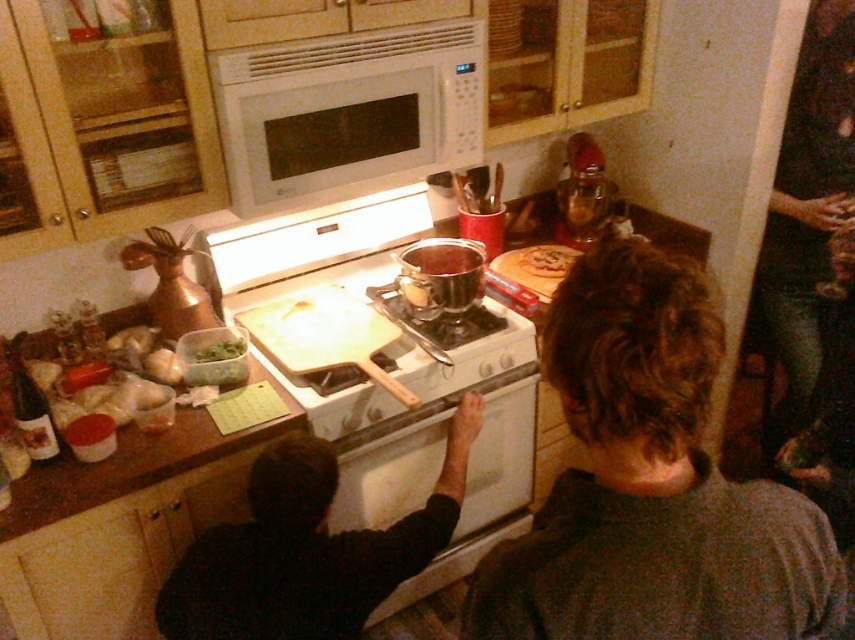
Between dark brown hair at center and white glossy stove at center, which one appears on the right side from the viewer's perspective?

From the viewer's perspective, dark brown hair at center appears more on the right side.

Between dark brown hair at center and white glossy stove at center, which one has less height?

dark brown hair at center is shorter.

The image size is (855, 640). Identify the location of dark brown hair at center. (652, 483).

Find the location of a particular element. Image resolution: width=855 pixels, height=640 pixels. dark brown hair at center is located at coordinates (652, 483).

Between white matte microwave at upper center and green leafy vegetables at upper left, which one has less height?

green leafy vegetables at upper left is shorter.

Between white matte microwave at upper center and green leafy vegetables at upper left, which one is positioned lower?

Positioned lower is green leafy vegetables at upper left.

Is point (345, 131) farther from camera compared to point (207, 353)?

That is False.

You are a GUI agent. You are given a task and a screenshot of the screen. Output one action in this format:
    pyautogui.click(x=<x>, y=<y>)
    Task: Click on the white matte microwave at upper center
    This screenshot has width=855, height=640.
    Given the screenshot: What is the action you would take?
    pyautogui.click(x=348, y=109)

Between dark brown hair at center and golden brown pastry at upper center, which one is positioned higher?

golden brown pastry at upper center is higher up.

From the picture: Which of these two, dark brown hair at center or golden brown pastry at upper center, stands taller?

dark brown hair at center is taller.

Is point (644, 246) in front of point (563, 269)?

That is True.

You are a GUI agent. You are given a task and a screenshot of the screen. Output one action in this format:
    pyautogui.click(x=<x>, y=<y>)
    Task: Click on the dark brown hair at center
    
    Given the screenshot: What is the action you would take?
    pyautogui.click(x=652, y=483)